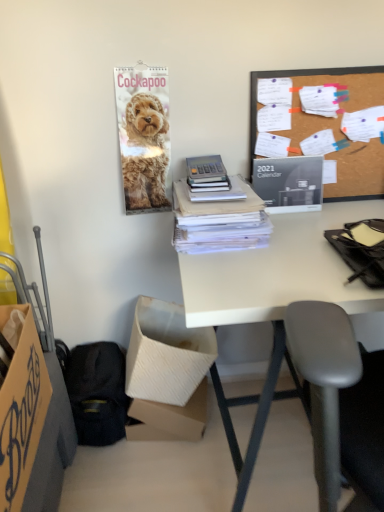
Question: From a real-world perspective, is black fabric handbag at lower left located beneath burlap-like fabric at upper right?

Choices:
 (A) no
 (B) yes

Answer: (B)

Question: Is black fabric handbag at lower left aimed at burlap-like fabric at upper right?

Choices:
 (A) yes
 (B) no

Answer: (B)

Question: Are black fabric handbag at lower left and burlap-like fabric at upper right located far from each other?

Choices:
 (A) yes
 (B) no

Answer: (B)

Question: Can you confirm if black fabric handbag at lower left is positioned to the right of burlap-like fabric at upper right?

Choices:
 (A) yes
 (B) no

Answer: (B)

Question: From a real-world perspective, is black fabric handbag at lower left over burlap-like fabric at upper right?

Choices:
 (A) no
 (B) yes

Answer: (A)

Question: Looking at the image, does golden fur calendar at upper left seem bigger or smaller compared to burlap-like fabric at upper right?

Choices:
 (A) small
 (B) big

Answer: (A)

Question: Is golden fur calendar at upper left spatially inside burlap-like fabric at upper right, or outside of it?

Choices:
 (A) inside
 (B) outside

Answer: (B)

Question: Visually, is golden fur calendar at upper left positioned to the left or to the right of burlap-like fabric at upper right?

Choices:
 (A) right
 (B) left

Answer: (B)

Question: From a real-world perspective, is golden fur calendar at upper left positioned above or below burlap-like fabric at upper right?

Choices:
 (A) above
 (B) below

Answer: (A)

Question: Does point (1, 318) appear closer or farther from the camera than point (226, 217)?

Choices:
 (A) farther
 (B) closer

Answer: (B)

Question: From a real-world perspective, is cardboard box at lower left, which appears as the third box when viewed from the back, above or below white paper at center?

Choices:
 (A) below
 (B) above

Answer: (A)

Question: Is cardboard box at lower left, which appears as the third box when viewed from the back, spatially inside white paper at center, or outside of it?

Choices:
 (A) inside
 (B) outside

Answer: (B)

Question: Based on their sizes in the image, would you say cardboard box at lower left, which appears as the third box when viewed from the back, is bigger or smaller than white paper at center?

Choices:
 (A) small
 (B) big

Answer: (B)

Question: Is black glossy calendar at upper right taller or shorter than white cardboard box at lower left, the 2th box from the back?

Choices:
 (A) short
 (B) tall

Answer: (A)

Question: From the image's perspective, relative to white cardboard box at lower left, which is counted as the 2th box, starting from the front, is black glossy calendar at upper right above or below?

Choices:
 (A) above
 (B) below

Answer: (A)